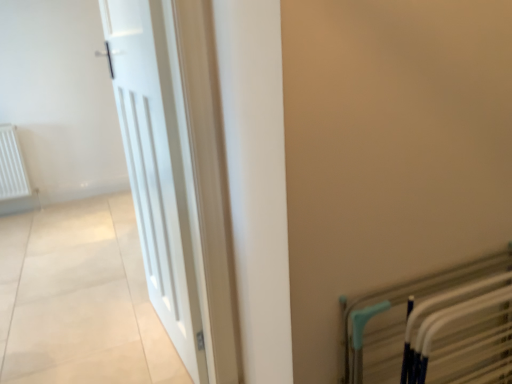
Describe the element at coordinates (156, 168) in the screenshot. Image resolution: width=512 pixels, height=384 pixels. I see `white wooden door at left` at that location.

This screenshot has width=512, height=384. Find the location of `white wooden door at left`. white wooden door at left is located at coordinates (156, 168).

In order to click on metallic silver bed frame at lower right in this screenshot , I will do `click(401, 316)`.

What do you see at coordinates (401, 316) in the screenshot? This screenshot has width=512, height=384. I see `metallic silver bed frame at lower right` at bounding box center [401, 316].

Identify the location of white wooden door at left. (156, 168).

Which object is positioned more to the right, white wooden door at left or metallic silver bed frame at lower right?

metallic silver bed frame at lower right.

Which object is closer to the camera, white wooden door at left or metallic silver bed frame at lower right?

metallic silver bed frame at lower right is more forward.

Which is in front, point (131, 49) or point (355, 348)?

The point (355, 348) is more forward.

From the image's perspective, which is below, white wooden door at left or metallic silver bed frame at lower right?

From the image's view, metallic silver bed frame at lower right is below.

From a real-world perspective, is white wooden door at left positioned above or below metallic silver bed frame at lower right?

Clearly, from a real-world perspective, white wooden door at left is above metallic silver bed frame at lower right.

Does white wooden door at left have a greater width compared to metallic silver bed frame at lower right?

Yes.

Considering the sizes of objects white wooden door at left and metallic silver bed frame at lower right in the image provided, who is shorter, white wooden door at left or metallic silver bed frame at lower right?

Standing shorter between the two is metallic silver bed frame at lower right.

Looking at the image, does white wooden door at left seem bigger or smaller compared to metallic silver bed frame at lower right?

Clearly, white wooden door at left is larger in size than metallic silver bed frame at lower right.

Is white wooden door at left outside of metallic silver bed frame at lower right?

white wooden door at left lies outside metallic silver bed frame at lower right's area.

In the scene shown: Would you consider white wooden door at left to be distant from metallic silver bed frame at lower right?

No, there isn't a large distance between white wooden door at left and metallic silver bed frame at lower right.

Is white wooden door at left facing towards metallic silver bed frame at lower right?

No, white wooden door at left is not turned towards metallic silver bed frame at lower right.

Can you tell me how much white wooden door at left and metallic silver bed frame at lower right differ in facing direction?

82.9 degrees separate the facing orientations of white wooden door at left and metallic silver bed frame at lower right.

The width and height of the screenshot is (512, 384). In order to click on bed frame that appears below the white wooden door at left (from a real-world perspective) in this screenshot , I will do `click(401, 316)`.

Does metallic silver bed frame at lower right appear on the right side of white wooden door at left?

Yes, metallic silver bed frame at lower right is to the right of white wooden door at left.

Which object is closer to the camera, metallic silver bed frame at lower right or white wooden door at left?

metallic silver bed frame at lower right.

Which is closer, (422, 282) or (182, 338)?

The point (422, 282) is more forward.

From the image's perspective, is metallic silver bed frame at lower right beneath white wooden door at left?

Indeed, from the image's perspective, metallic silver bed frame at lower right is shown beneath white wooden door at left.

From a real-world perspective, who is located higher, metallic silver bed frame at lower right or white wooden door at left?

white wooden door at left, from a real-world perspective.

Can you confirm if metallic silver bed frame at lower right is wider than white wooden door at left?

In fact, metallic silver bed frame at lower right might be narrower than white wooden door at left.

Can you confirm if metallic silver bed frame at lower right is taller than white wooden door at left?

No.

Is metallic silver bed frame at lower right bigger than white wooden door at left?

No.

Is white wooden door at left inside metallic silver bed frame at lower right?

No.

Is metallic silver bed frame at lower right far from white wooden door at left?

No, metallic silver bed frame at lower right is not far away from white wooden door at left.

Is metallic silver bed frame at lower right positioned with its back to white wooden door at left?

Yes, metallic silver bed frame at lower right is positioned with its back facing white wooden door at left.

Looking at this image, how many degrees apart are the facing directions of metallic silver bed frame at lower right and white wooden door at left?

The angular difference between metallic silver bed frame at lower right and white wooden door at left is 82.9 degrees.

Measure the distance between metallic silver bed frame at lower right and white wooden door at left.

metallic silver bed frame at lower right is 34.28 inches away from white wooden door at left.

Where is `bed frame below the white wooden door at left (from the image's perspective)`? This screenshot has height=384, width=512. bed frame below the white wooden door at left (from the image's perspective) is located at coordinates (401, 316).

This screenshot has height=384, width=512. In the image, there is a white wooden door at left. Find the location of `bed frame below it (from the image's perspective)`. bed frame below it (from the image's perspective) is located at coordinates (401, 316).

Locate an element on the screen. The height and width of the screenshot is (384, 512). door to the left of metallic silver bed frame at lower right is located at coordinates (156, 168).